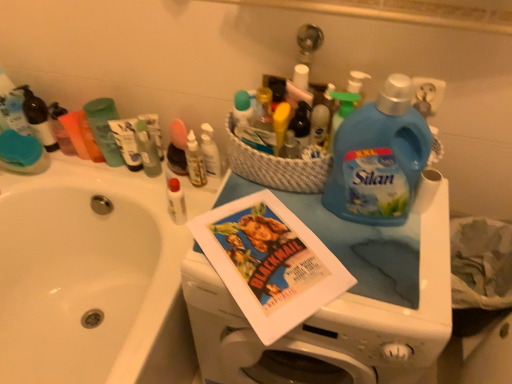
Find the location of a particular element. free space in front of blue plastic bottle at upper right, the 2th cleaning product positioned from the left is located at coordinates (384, 272).